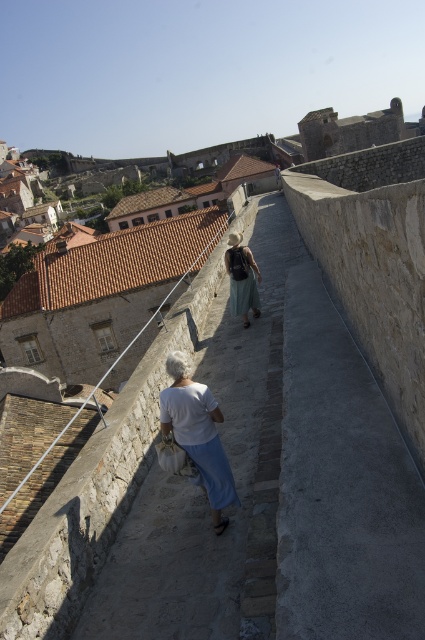
Is white cotton shirt at center bigger than light green fabric dress at center?

No.

Which is in front, point (209, 472) or point (241, 269)?

Point (209, 472)

You are a GUI agent. You are given a task and a screenshot of the screen. Output one action in this format:
    pyautogui.click(x=<x>, y=<y>)
    Task: Click on the white cotton shirt at center
    
    Given the screenshot: What is the action you would take?
    pyautogui.click(x=198, y=433)